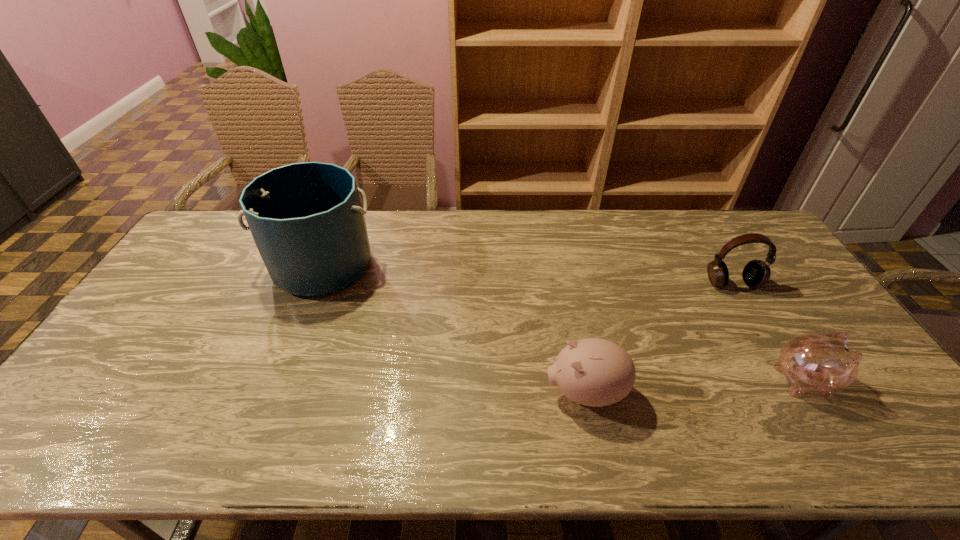
At what (x,y) coordinates should I click in order to perform the action: click on vacant space that satisfies the following two spatial constraints: 1. on the ear pads of the headset; 2. at the snout of the left piggy bank. Please return your answer as a coordinate pair (x, y). Image resolution: width=960 pixels, height=540 pixels. Looking at the image, I should click on (798, 393).

Image resolution: width=960 pixels, height=540 pixels. I want to click on vacant area that satisfies the following two spatial constraints: 1. on the front side of the bucket; 2. on the front facing side of the right piggy bank, so click(x=276, y=380).

This screenshot has height=540, width=960. Find the location of `free region that satisfies the following two spatial constraints: 1. on the ear pads of the headset; 2. on the front facing side of the right piggy bank`. free region that satisfies the following two spatial constraints: 1. on the ear pads of the headset; 2. on the front facing side of the right piggy bank is located at coordinates (791, 380).